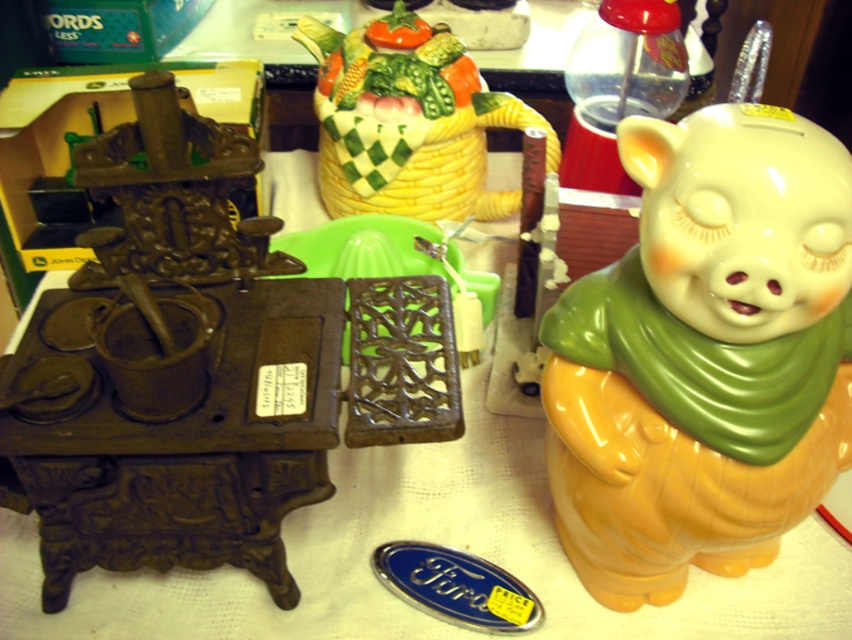
Question: Does matte yellow piggy bank at right have a larger size compared to porcelain basket at upper center?

Choices:
 (A) yes
 (B) no

Answer: (A)

Question: Which point is closer to the camera?

Choices:
 (A) (366, 209)
 (B) (753, 291)

Answer: (B)

Question: Is matte yellow piggy bank at right positioned behind porcelain basket at upper center?

Choices:
 (A) yes
 (B) no

Answer: (B)

Question: Can you confirm if matte yellow piggy bank at right is positioned to the left of porcelain basket at upper center?

Choices:
 (A) no
 (B) yes

Answer: (A)